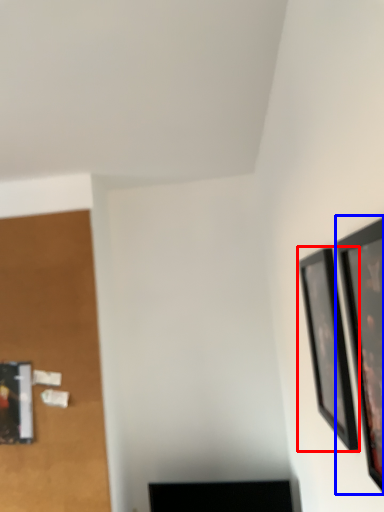
Question: Which point is closer to the camera, picture frame (highlighted by a red box) or picture frame (highlighted by a blue box)?

Choices:
 (A) picture frame
 (B) picture frame

Answer: (B)